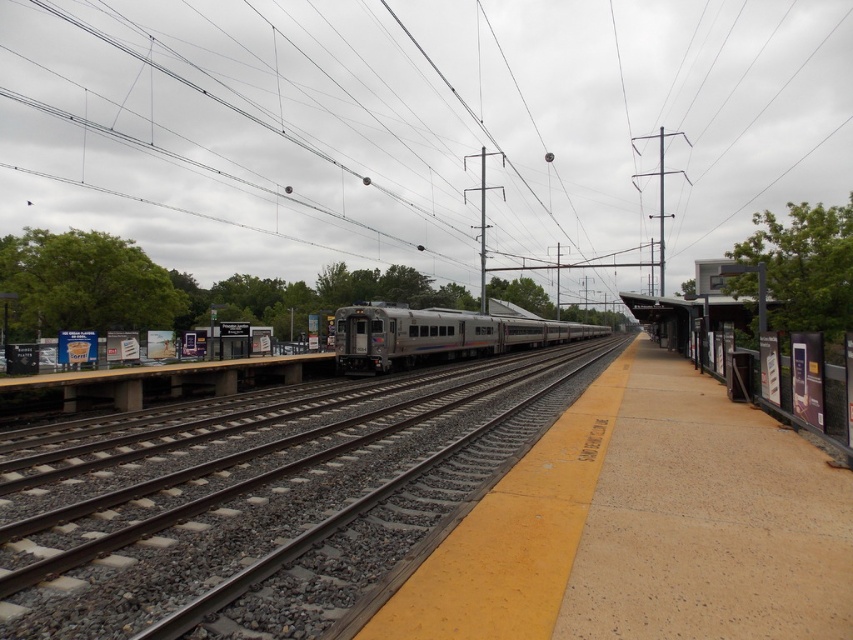
Question: Estimate the real-world distances between objects in this image. Which object is farther from the silver metallic train track at center?

Choices:
 (A) silver metallic train at center
 (B) metallic wires at center
 (C) concrete platform at center

Answer: (B)

Question: Does silver metallic train track at center come behind silver metallic train at center?

Choices:
 (A) yes
 (B) no

Answer: (B)

Question: Does metallic wires at center appear under silver metallic train at center?

Choices:
 (A) yes
 (B) no

Answer: (B)

Question: From the image, what is the correct spatial relationship of metallic wires at center in relation to concrete platform at center?

Choices:
 (A) left
 (B) right

Answer: (A)

Question: Which of the following is the closest to the observer?

Choices:
 (A) metallic wires at center
 (B) concrete platform at center

Answer: (B)

Question: Which of the following is the farthest from the observer?

Choices:
 (A) silver metallic train at center
 (B) concrete platform at center

Answer: (A)